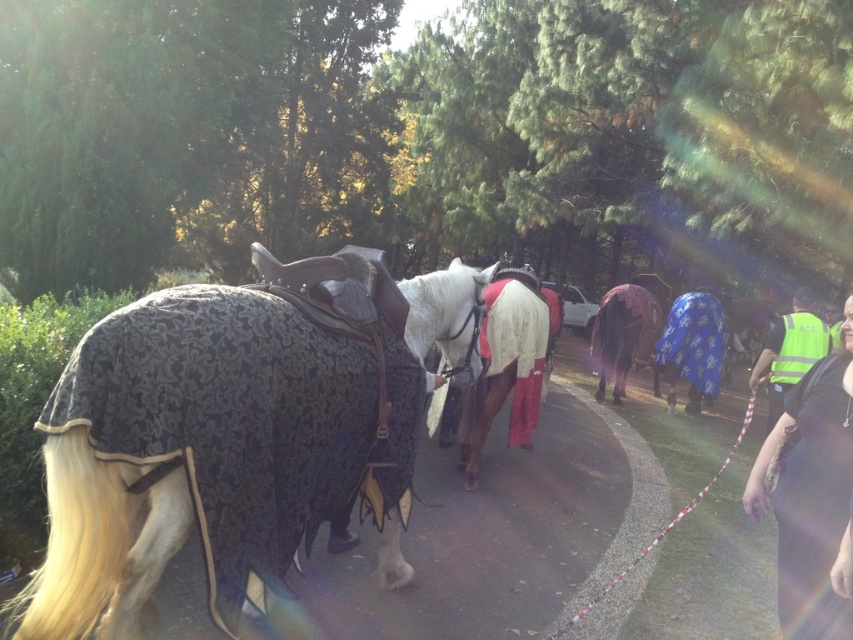
Measure the distance from black textured blanket at left to yellow reflective vest at right.

black textured blanket at left is 3.78 meters from yellow reflective vest at right.

Is black textured blanket at left smaller than yellow reflective vest at right?

No.

This screenshot has height=640, width=853. What are the coordinates of `black textured blanket at left` in the screenshot? It's located at (99, 545).

Looking at this image, between black textured blanket at left and reflective yellow vest at right, which one appears on the right side from the viewer's perspective?

reflective yellow vest at right

Is point (51, 524) behind point (843, 564)?

That is False.

The image size is (853, 640). What do you see at coordinates (99, 545) in the screenshot?
I see `black textured blanket at left` at bounding box center [99, 545].

The width and height of the screenshot is (853, 640). I want to click on black textured blanket at left, so click(x=99, y=545).

Which is behind, point (824, 550) or point (521, 285)?

The point (521, 285) is more distant.

Based on the photo, who is higher up, reflective yellow vest at right or white clothed horse at center?

white clothed horse at center

Between point (834, 355) and point (486, 365), which one is positioned in front?

Point (834, 355)

This screenshot has height=640, width=853. Find the location of `reflective yellow vest at right`. reflective yellow vest at right is located at coordinates (811, 497).